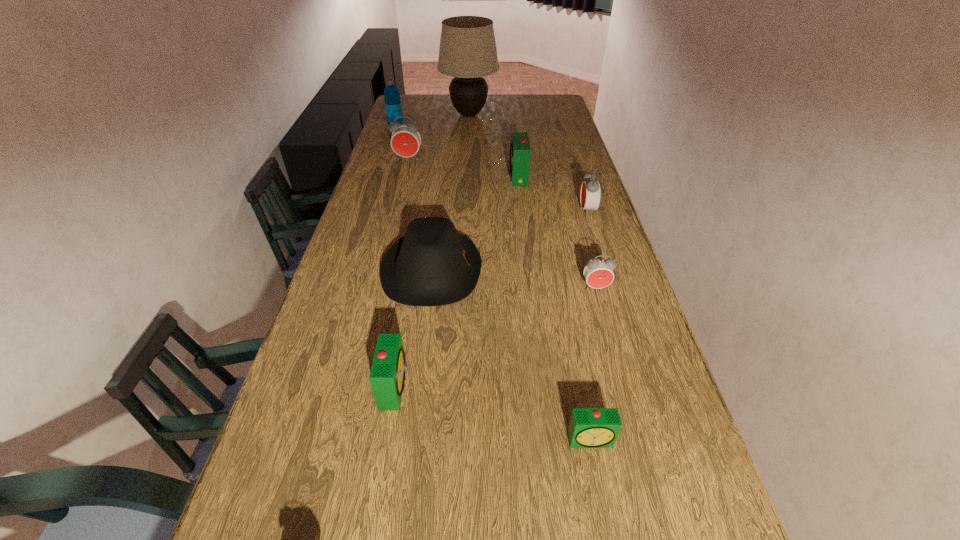
The width and height of the screenshot is (960, 540). What are the coordinates of `free spot between the gray fedora and the tallest object` in the screenshot? It's located at (x=450, y=193).

The width and height of the screenshot is (960, 540). I want to click on free space between the smallest red alarm clock and the fourth farthest object, so click(x=557, y=232).

Find the location of a particular element. The image size is (960, 540). object identified as the seventh closest to the nearest green alarm clock is located at coordinates (467, 51).

Locate an element on the screen. object that ranks as the sixth closest to the gray fedora is located at coordinates (405, 141).

The image size is (960, 540). What are the coordinates of `alarm clock that is the closest to the second biggest green alarm clock` in the screenshot? It's located at (589, 427).

What are the coordinates of `alarm clock that is the third closest to the smallest red alarm clock` in the screenshot? It's located at (387, 376).

Identify which red alarm clock is located as the nearest to the fedora. Please provide its 2D coordinates. Your answer should be formatted as a tuple, i.e. [(x, y)], where the tuple contains the x and y coordinates of a point satisfying the conditions above.

[(598, 273)]

Where is `red alarm clock that is the second closest to the third nearest alarm clock`? red alarm clock that is the second closest to the third nearest alarm clock is located at coordinates (405, 141).

Where is `green alarm clock that is the second closest to the thermos bottle`? Image resolution: width=960 pixels, height=540 pixels. green alarm clock that is the second closest to the thermos bottle is located at coordinates (387, 376).

At what (x,y) coordinates should I click in order to perform the action: click on the second closest green alarm clock to the third object from right to left. Please return your answer as a coordinate pair (x, y). Image resolution: width=960 pixels, height=540 pixels. Looking at the image, I should click on (520, 150).